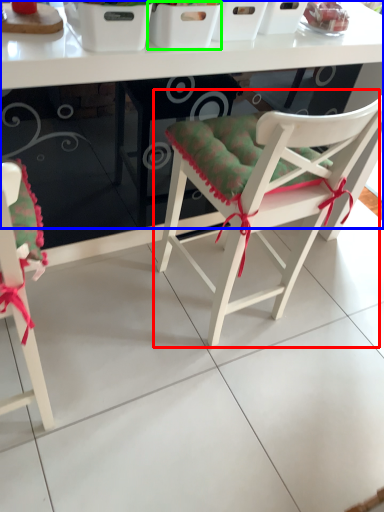
Question: Which object is the farthest from chair (highlighted by a red box)? Choose among these: table (highlighted by a blue box) or basket (highlighted by a green box).

Choices:
 (A) table
 (B) basket

Answer: (B)